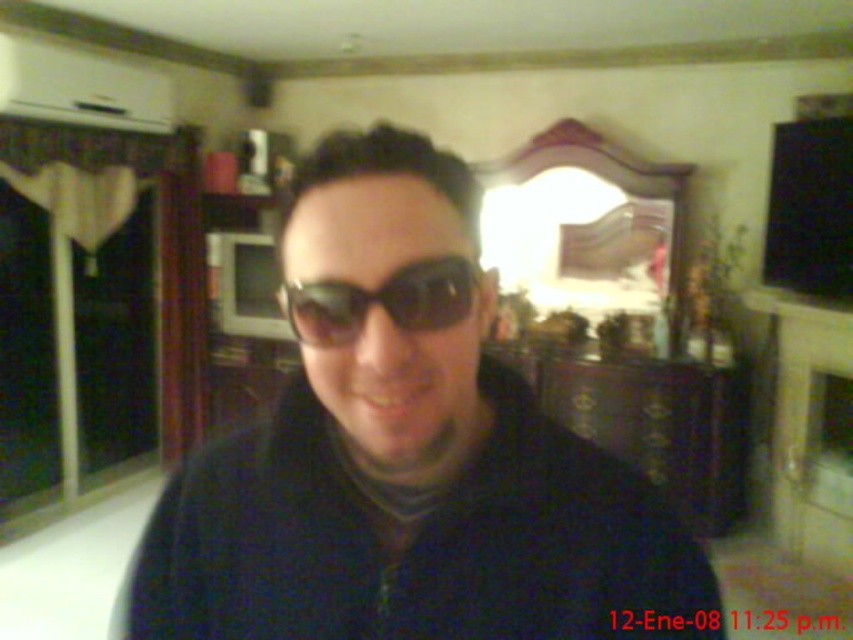
Who is higher up, black matte sunglasses at center or black reflective sunglasses at center?

Positioned higher is black reflective sunglasses at center.

Is black matte sunglasses at center to the left of black reflective sunglasses at center from the viewer's perspective?

No, black matte sunglasses at center is not to the left of black reflective sunglasses at center.

Locate an element on the screen. The image size is (853, 640). black matte sunglasses at center is located at coordinates (405, 452).